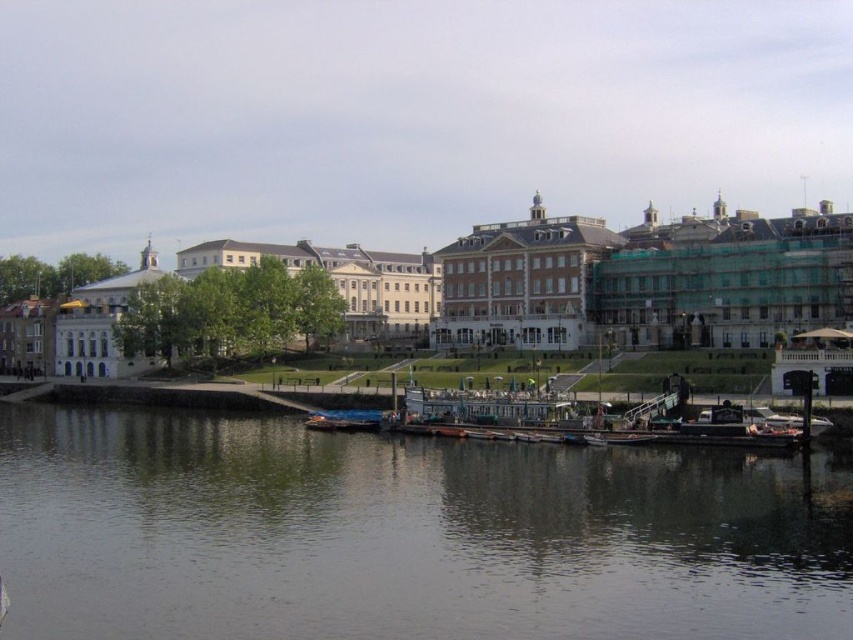
Is point (500, 496) closer to viewer compared to point (363, 410)?

Yes, point (500, 496) is in front of point (363, 410).

Does dark gray water at lower center appear on the right side of blue metallic boat at lower center?

Yes, dark gray water at lower center is to the right of blue metallic boat at lower center.

You are a GUI agent. You are given a task and a screenshot of the screen. Output one action in this format:
    pyautogui.click(x=<x>, y=<y>)
    Task: Click on the dark gray water at lower center
    The height and width of the screenshot is (640, 853).
    Given the screenshot: What is the action you would take?
    pyautogui.click(x=404, y=536)